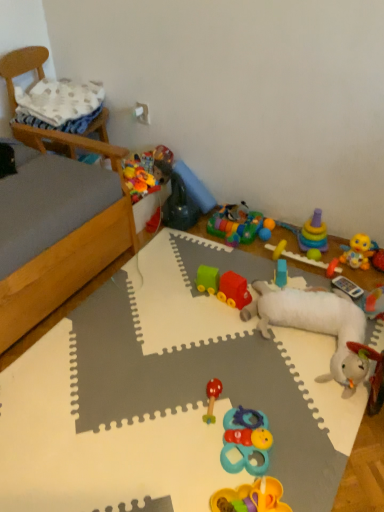
This screenshot has width=384, height=512. Describe the element at coordinates (358, 252) in the screenshot. I see `yellow rubber duck at right, the 3th toy from the top` at that location.

Locate an element on the screen. The height and width of the screenshot is (512, 384). green rubber ball at upper right, the fourth toy from the top is located at coordinates (314, 254).

The image size is (384, 512). Describe the element at coordinates (179, 206) in the screenshot. I see `rubberized green toy at center, positioned as the 1th toy in top-to-bottom order` at that location.

The width and height of the screenshot is (384, 512). Describe the element at coordinates (212, 398) in the screenshot. I see `rubberized red mushroom at center, which is counted as the ninth toy, starting from the top` at that location.

What is the approximate height of multicolored plastic blocks at center, the second toy from the top?

The height of multicolored plastic blocks at center, the second toy from the top, is 2.63 inches.

The height and width of the screenshot is (512, 384). Identify the location of yellow rubber duck at right, which is the eighth toy from bottom to top. click(x=358, y=252).

Starting from the white plush sheep at center, the third toy ordered from the bottom, which toy is the 6th one behind? Please provide its 2D coordinates.

[(179, 206)]

Considering the relative sizes of white plush sheep at center, the third toy ordered from the bottom, and rubberized green toy at center, positioned as the 1th toy in top-to-bottom order, in the image provided, is white plush sheep at center, the third toy ordered from the bottom, smaller than rubberized green toy at center, positioned as the 1th toy in top-to-bottom order,?

No.

Is white plush sheep at center, the 8th toy viewed from the top, far away from rubberized green toy at center, the tenth toy when ordered from bottom to top?

No, white plush sheep at center, the 8th toy viewed from the top, is not far from rubberized green toy at center, the tenth toy when ordered from bottom to top.

Considering the sizes of objects white plush sheep at center, the third toy ordered from the bottom, and rubberized green toy at center, the tenth toy when ordered from bottom to top, in the image provided, who is taller, white plush sheep at center, the third toy ordered from the bottom, or rubberized green toy at center, the tenth toy when ordered from bottom to top,?

With more height is rubberized green toy at center, the tenth toy when ordered from bottom to top.

Can we say blue plastic toy at center, which is counted as the sixth toy, starting from the top, lies outside wooden chair at upper left?

Indeed, blue plastic toy at center, which is counted as the sixth toy, starting from the top, is completely outside wooden chair at upper left.

Is blue plastic toy at center, which is counted as the sixth toy, starting from the top, not close to wooden chair at upper left?

Yes, blue plastic toy at center, which is counted as the sixth toy, starting from the top, and wooden chair at upper left are quite far apart.

Does blue plastic toy at center, which is counted as the sixth toy, starting from the top, have a lesser width compared to wooden chair at upper left?

Yes.

From a real-world perspective, who is located lower, blue plastic toy at center, which appears as the fifth toy when ordered from the bottom, or wooden chair at upper left?

blue plastic toy at center, which appears as the fifth toy when ordered from the bottom.

Can you confirm if blue plastic toy at center, which appears as the fifth toy when ordered from the bottom, is bigger than multicolored plastic blocks at center, acting as the ninth toy starting from the bottom?

No, blue plastic toy at center, which appears as the fifth toy when ordered from the bottom, is not bigger than multicolored plastic blocks at center, acting as the ninth toy starting from the bottom.

Can you tell me how much blue plastic toy at center, which is counted as the sixth toy, starting from the top, and multicolored plastic blocks at center, acting as the ninth toy starting from the bottom, differ in facing direction?

75.8 degrees.

Is blue plastic toy at center, which appears as the fifth toy when ordered from the bottom, aimed at multicolored plastic blocks at center, acting as the ninth toy starting from the bottom?

No, blue plastic toy at center, which appears as the fifth toy when ordered from the bottom, is not aimed at multicolored plastic blocks at center, acting as the ninth toy starting from the bottom.

In the scene shown: Considering the positions of objects blue plastic toy at center, which is counted as the sixth toy, starting from the top, and multicolored plastic blocks at center, the second toy from the top, in the image provided, who is behind, blue plastic toy at center, which is counted as the sixth toy, starting from the top, or multicolored plastic blocks at center, the second toy from the top,?

multicolored plastic blocks at center, the second toy from the top, is further from the camera.

Which object is thinner, rubberized red mushroom at center, which is counted as the ninth toy, starting from the top, or multicolored plastic toy at upper right, which is counted as the sixth toy, starting from the bottom?

With smaller width is multicolored plastic toy at upper right, which is counted as the sixth toy, starting from the bottom.

Can you confirm if rubberized red mushroom at center, which is counted as the 2th toy, starting from the bottom, is bigger than multicolored plastic toy at upper right, the fifth toy when ordered from top to bottom?

Incorrect, rubberized red mushroom at center, which is counted as the 2th toy, starting from the bottom, is not larger than multicolored plastic toy at upper right, the fifth toy when ordered from top to bottom.

Who is taller, rubberized red mushroom at center, which is counted as the ninth toy, starting from the top, or multicolored plastic toy at upper right, which is counted as the sixth toy, starting from the bottom?

multicolored plastic toy at upper right, which is counted as the sixth toy, starting from the bottom.

Between rubberized green toy at center, the tenth toy when ordered from bottom to top, and wooden table at center, which one has more height?

rubberized green toy at center, the tenth toy when ordered from bottom to top, is taller.

How far apart are rubberized green toy at center, the tenth toy when ordered from bottom to top, and wooden table at center?

rubberized green toy at center, the tenth toy when ordered from bottom to top, and wooden table at center are 10.75 inches apart.

Is rubberized green toy at center, the tenth toy when ordered from bottom to top, inside or outside of wooden table at center?

rubberized green toy at center, the tenth toy when ordered from bottom to top, is not inside wooden table at center, it's outside.

From the image's perspective, between rubberized green toy at center, positioned as the 1th toy in top-to-bottom order, and wooden table at center, which one is located above?

rubberized green toy at center, positioned as the 1th toy in top-to-bottom order, from the image's perspective.

In the scene shown: Is rubberized green toy at center, the tenth toy when ordered from bottom to top, turned away from white plush sheep at center, the third toy ordered from the bottom?

No.

Can we say rubberized green toy at center, the tenth toy when ordered from bottom to top, lies outside white plush sheep at center, the 8th toy viewed from the top?

Yes, rubberized green toy at center, the tenth toy when ordered from bottom to top, is outside of white plush sheep at center, the 8th toy viewed from the top.

Would you consider rubberized green toy at center, positioned as the 1th toy in top-to-bottom order, to be distant from white plush sheep at center, the 8th toy viewed from the top?

No, rubberized green toy at center, positioned as the 1th toy in top-to-bottom order, is not far from white plush sheep at center, the 8th toy viewed from the top.

Identify the location of the 2nd toy located beneath the rubberized green toy at center, the tenth toy when ordered from bottom to top (from a real-world perspective). 316,324.

Can you tell me how much white plush sheep at center, the third toy ordered from the bottom, and yellow rubber duck at right, the 3th toy from the top, differ in facing direction?

The angular difference between white plush sheep at center, the third toy ordered from the bottom, and yellow rubber duck at right, the 3th toy from the top, is 1.65 degrees.

Does point (281, 317) come in front of point (365, 245)?

Yes, point (281, 317) is closer to viewer.

Is white plush sheep at center, the 8th toy viewed from the top, aimed at yellow rubber duck at right, the 3th toy from the top?

No, white plush sheep at center, the 8th toy viewed from the top, does not turn towards yellow rubber duck at right, the 3th toy from the top.

Are white plush sheep at center, the third toy ordered from the bottom, and yellow rubber duck at right, which is the eighth toy from bottom to top, far apart?

No, white plush sheep at center, the third toy ordered from the bottom, is not far away from yellow rubber duck at right, which is the eighth toy from bottom to top.

Locate an element on the screen. Image resolution: width=384 pixels, height=512 pixels. toy that is the 2nd object above the white plush sheep at center, the third toy ordered from the bottom (from a real-world perspective) is located at coordinates (179, 206).

This screenshot has height=512, width=384. Identify the location of the 6th toy below the wooden chair at upper left (from the image's perspective). (281, 273).

Considering their positions, is rubberized red mushroom at center, which is counted as the 2th toy, starting from the bottom, positioned closer to green rubber ball at upper right, arranged as the 7th toy when ordered from the bottom, than blue plastic toy at center, which is counted as the sixth toy, starting from the top?

Based on the image, blue plastic toy at center, which is counted as the sixth toy, starting from the top, appears to be nearer to green rubber ball at upper right, arranged as the 7th toy when ordered from the bottom.

When comparing their distances from yellow rubber duck at right, the 3th toy from the top, does rubberized red mushroom at center, which is counted as the ninth toy, starting from the top, or multicolored plastic blocks at center, acting as the ninth toy starting from the bottom, seem further?

Based on the image, rubberized red mushroom at center, which is counted as the ninth toy, starting from the top, appears to be further to yellow rubber duck at right, the 3th toy from the top.

Which object lies nearer to the anchor point green rubber ball at upper right, arranged as the 7th toy when ordered from the bottom, blue rubber teething ring at center, positioned as the first toy in bottom-to-top order, or blue plastic toy at center, which appears as the fifth toy when ordered from the bottom?

Among the two, blue plastic toy at center, which appears as the fifth toy when ordered from the bottom, is located nearer to green rubber ball at upper right, arranged as the 7th toy when ordered from the bottom.

Looking at the image, which one is located further to yellow rubber duck at right, which is the eighth toy from bottom to top, green rubber ball at upper right, the fourth toy from the top, or blue rubber teething ring at center, positioned as the first toy in bottom-to-top order?

Among the two, blue rubber teething ring at center, positioned as the first toy in bottom-to-top order, is located further to yellow rubber duck at right, which is the eighth toy from bottom to top.

Estimate the real-world distances between objects in this image. Which object is closer to rubberized plastic train at center, which is counted as the 4th toy, starting from the bottom, blue rubber teething ring at center, the 10th toy in the top-to-bottom sequence, or wooden bed frame at left?

blue rubber teething ring at center, the 10th toy in the top-to-bottom sequence.

Estimate the real-world distances between objects in this image. Which object is further from green rubber ball at upper right, the fourth toy from the top, blue rubber teething ring at center, positioned as the first toy in bottom-to-top order, or wooden table at center?

Based on the image, wooden table at center appears to be further to green rubber ball at upper right, the fourth toy from the top.

When comparing their distances from rubberized green toy at center, positioned as the 1th toy in top-to-bottom order, does rubberized red mushroom at center, which is counted as the ninth toy, starting from the top, or green rubber ball at upper right, the fourth toy from the top, seem further?

rubberized red mushroom at center, which is counted as the ninth toy, starting from the top, is positioned further to the anchor rubberized green toy at center, positioned as the 1th toy in top-to-bottom order.

Considering their positions, is wooden bed frame at left positioned further to yellow rubber duck at right, which is the eighth toy from bottom to top, than rubberized green toy at center, the tenth toy when ordered from bottom to top?

Based on the image, wooden bed frame at left appears to be further to yellow rubber duck at right, which is the eighth toy from bottom to top.

You are a GUI agent. You are given a task and a screenshot of the screen. Output one action in this format:
    pyautogui.click(x=<x>, y=<y>)
    Task: Click on the table between wooden bed frame at left and rubberized plastic train at center, the 7th toy when ordered from top to bottom, in the horizontal direction
    The image size is (384, 512).
    Given the screenshot: What is the action you would take?
    pyautogui.click(x=364, y=470)

You are a GUI agent. You are given a task and a screenshot of the screen. Output one action in this format:
    pyautogui.click(x=<x>, y=<y>)
    Task: Click on the bed frame between wooden chair at upper left and wooden table at center in the up-down direction
    
    Given the screenshot: What is the action you would take?
    pyautogui.click(x=63, y=234)

Find the location of `table between wooden chair at upper left and rubberized red mushroom at center, which is counted as the 2th toy, starting from the bottom, in the up-down direction`. table between wooden chair at upper left and rubberized red mushroom at center, which is counted as the 2th toy, starting from the bottom, in the up-down direction is located at coordinates (364, 470).

Find the location of a particular element. This screenshot has height=512, width=384. bed frame positioned between wooden table at center and multicolored plastic blocks at center, acting as the ninth toy starting from the bottom, from near to far is located at coordinates (63, 234).